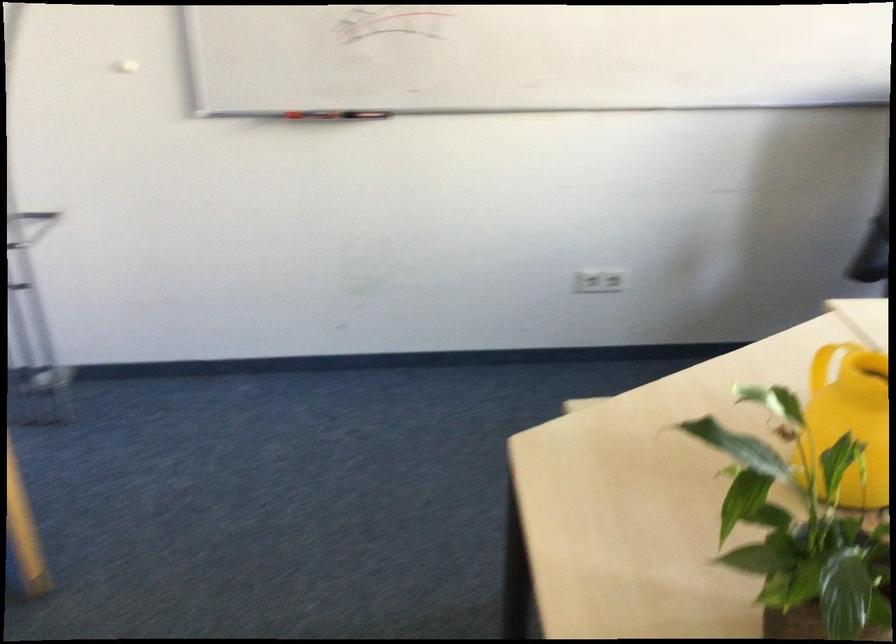
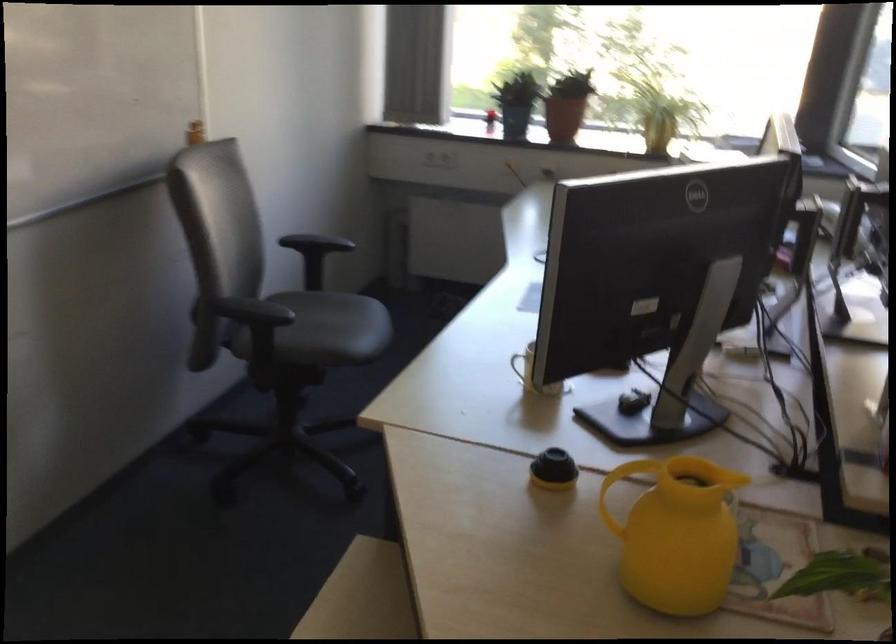
Question: The camera is either moving clockwise (left) or counter-clockwise (right) around the object. The first image is from the beginning of the video and the second image is from the end. Is the camera moving left or right when shooting the video?

Choices:
 (A) Left
 (B) Right

Answer: (A)